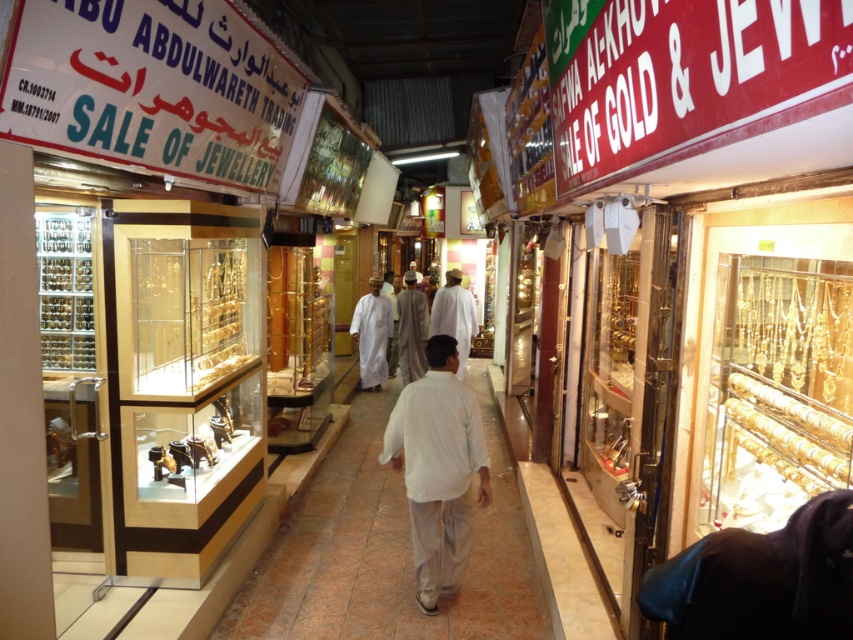
Does white cloth at center have a lesser width compared to light beige fabric at center?

Incorrect, white cloth at center's width is not less than light beige fabric at center's.

Where is `white cloth at center`? This screenshot has height=640, width=853. white cloth at center is located at coordinates (454, 316).

At what (x,y) coordinates should I click in order to perform the action: click on white cloth at center. Please return your answer as a coordinate pair (x, y). The height and width of the screenshot is (640, 853). Looking at the image, I should click on [x=454, y=316].

Measure the distance from white cotton shirt at center to white cloth at center.

white cotton shirt at center is 19.45 feet from white cloth at center.

Which is behind, point (463, 413) or point (444, 305)?

Positioned behind is point (444, 305).

Image resolution: width=853 pixels, height=640 pixels. I want to click on white cotton shirt at center, so click(438, 468).

Who is more forward, (454, 564) or (383, 340)?

Positioned in front is point (454, 564).

Between point (436, 484) and point (357, 307), which one is positioned in front?

Positioned in front is point (436, 484).

Identify the location of white cotton shirt at center. (438, 468).